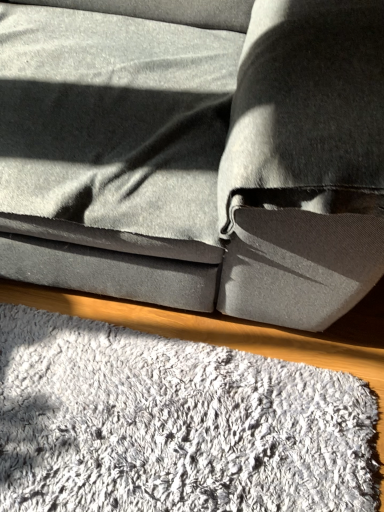
The image size is (384, 512). Describe the element at coordinates (173, 425) in the screenshot. I see `white fluffy mat at lower center` at that location.

The image size is (384, 512). Identify the location of white fluffy mat at lower center. (173, 425).

The width and height of the screenshot is (384, 512). What do you see at coordinates (198, 157) in the screenshot?
I see `suede gray couch at center` at bounding box center [198, 157].

This screenshot has height=512, width=384. Find the location of `suede gray couch at center`. suede gray couch at center is located at coordinates (198, 157).

What is the approximate width of suede gray couch at center?

suede gray couch at center is 1.05 meters in width.

What is the approximate height of suede gray couch at center?

It is 82.14 centimeters.

This screenshot has height=512, width=384. I want to click on white fluffy mat at lower center, so click(x=173, y=425).

Visually, is white fluffy mat at lower center positioned to the left or to the right of suede gray couch at center?

From the image, it's evident that white fluffy mat at lower center is to the right of suede gray couch at center.

Considering the positions of objects white fluffy mat at lower center and suede gray couch at center in the image provided, who is in front, white fluffy mat at lower center or suede gray couch at center?

suede gray couch at center.

Between point (348, 506) and point (84, 20), which one is positioned in front?

Point (348, 506)

From the image's perspective, which is below, white fluffy mat at lower center or suede gray couch at center?

white fluffy mat at lower center.

From a real-world perspective, which object rests below the other?

white fluffy mat at lower center.

Considering the relative sizes of white fluffy mat at lower center and suede gray couch at center in the image provided, is white fluffy mat at lower center wider than suede gray couch at center?

No, white fluffy mat at lower center is not wider than suede gray couch at center.

Who is taller, white fluffy mat at lower center or suede gray couch at center?

suede gray couch at center.

Which of these two, white fluffy mat at lower center or suede gray couch at center, is bigger?

suede gray couch at center is bigger.

Is white fluffy mat at lower center spatially inside suede gray couch at center, or outside of it?

white fluffy mat at lower center is spatially situated outside suede gray couch at center.

Looking at this image, is there a large distance between white fluffy mat at lower center and suede gray couch at center?

white fluffy mat at lower center is actually quite close to suede gray couch at center.

Could you tell me if white fluffy mat at lower center is facing suede gray couch at center?

No, white fluffy mat at lower center is not aimed at suede gray couch at center.

How different are the orientations of white fluffy mat at lower center and suede gray couch at center in degrees?

The angular difference between white fluffy mat at lower center and suede gray couch at center is 0.332 degrees.

Where is `studio couch above the white fluffy mat at lower center (from the image's perspective)`? studio couch above the white fluffy mat at lower center (from the image's perspective) is located at coordinates coord(198,157).

Can you confirm if suede gray couch at center is positioned to the left of white fluffy mat at lower center?

Yes.

Considering their positions, is suede gray couch at center located in front of or behind white fluffy mat at lower center?

suede gray couch at center is positioned closer to the viewer than white fluffy mat at lower center.

Which is closer to the camera, (67, 86) or (125, 472)?

Point (67, 86).

From the image's perspective, which is below, suede gray couch at center or white fluffy mat at lower center?

white fluffy mat at lower center appears lower in the image.

From a real-world perspective, is suede gray couch at center over white fluffy mat at lower center?

Yes, from a real-world perspective, suede gray couch at center is on top of white fluffy mat at lower center.

Looking at this image, does suede gray couch at center have a lesser width compared to white fluffy mat at lower center?

Incorrect, the width of suede gray couch at center is not less than that of white fluffy mat at lower center.

Does suede gray couch at center have a lesser height compared to white fluffy mat at lower center?

No.

Considering the sizes of objects suede gray couch at center and white fluffy mat at lower center in the image provided, who is smaller, suede gray couch at center or white fluffy mat at lower center?

Smaller between the two is white fluffy mat at lower center.

Is suede gray couch at center outside of white fluffy mat at lower center?

Indeed, suede gray couch at center is completely outside white fluffy mat at lower center.

Are suede gray couch at center and white fluffy mat at lower center located far from each other?

Actually, suede gray couch at center and white fluffy mat at lower center are a little close together.

Is suede gray couch at center looking in the opposite direction of white fluffy mat at lower center?

suede gray couch at center does not have its back to white fluffy mat at lower center.

Can you tell me how much suede gray couch at center and white fluffy mat at lower center differ in facing direction?

0.332 degrees.

Measure the distance between suede gray couch at center and white fluffy mat at lower center.

suede gray couch at center is 16.46 inches away from white fluffy mat at lower center.

This screenshot has height=512, width=384. In order to click on mat behind the suede gray couch at center in this screenshot , I will do `click(173, 425)`.

At what (x,y) coordinates should I click in order to perform the action: click on mat on the right of suede gray couch at center. Please return your answer as a coordinate pair (x, y). The height and width of the screenshot is (512, 384). Looking at the image, I should click on (173, 425).

Where is `mat below the suede gray couch at center (from a real-world perspective)`? The height and width of the screenshot is (512, 384). mat below the suede gray couch at center (from a real-world perspective) is located at coordinates (173, 425).